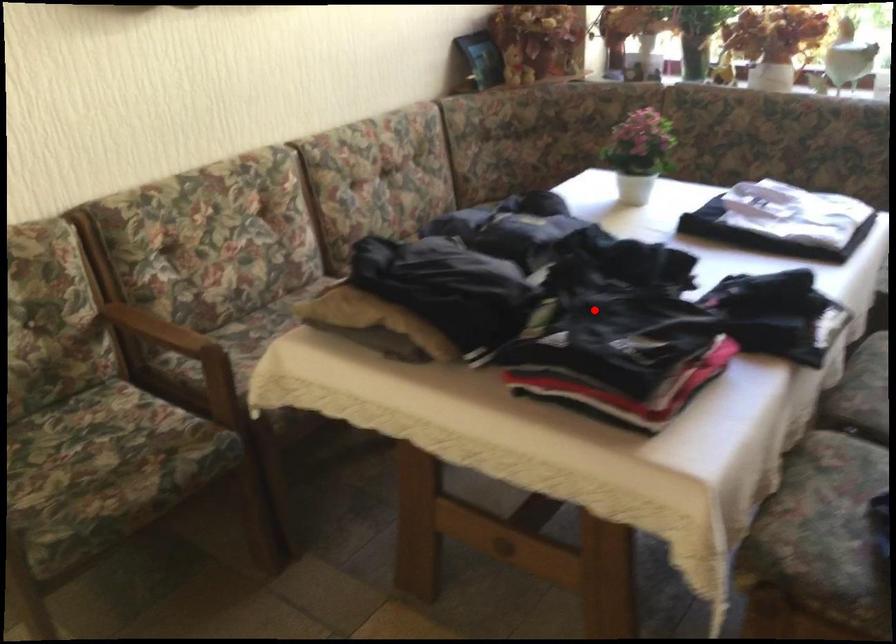
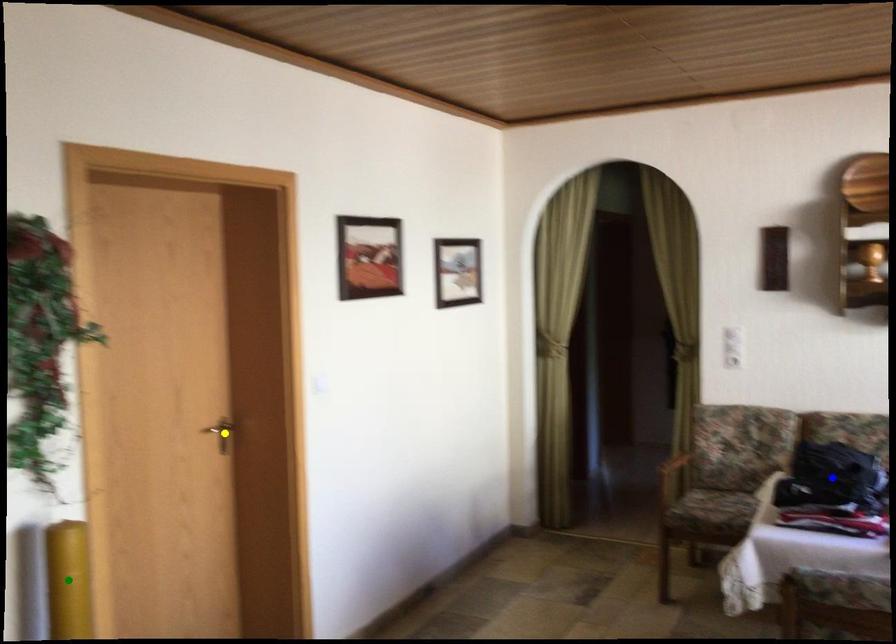
Question: I am providing you with two images of the same scene from different viewpoints. A red point is marked on the first image. You are given multiple points on the second image. Which point in image 2 is actually the same real-world point as the red point in image 1?

Choices:
 (A) yellow point
 (B) green point
 (C) blue point

Answer: (C)